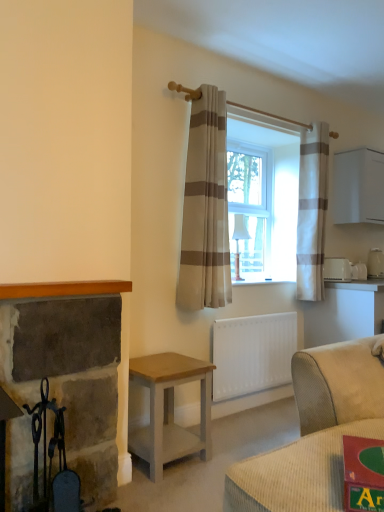
Locate an element on the screen. The height and width of the screenshot is (512, 384). black wrought iron fireplace tools at left is located at coordinates pos(52,458).

What do you see at coordinates (252, 354) in the screenshot? I see `white matte radiator at lower center` at bounding box center [252, 354].

How much space does white plastic toaster at right, positioned as the third appliance in left-to-right order, occupy vertically?

white plastic toaster at right, positioned as the third appliance in left-to-right order, is 11.09 inches in height.

What do you see at coordinates (375, 263) in the screenshot? I see `white plastic toaster at right, which ranks as the first appliance in right-to-left order` at bounding box center [375, 263].

Describe the element at coordinates (205, 207) in the screenshot. I see `beige striped curtain at center, the 1th curtain positioned from the front` at that location.

Where is `white plastic toaster at right, the third appliance positioned from the right`? The image size is (384, 512). white plastic toaster at right, the third appliance positioned from the right is located at coordinates (337, 269).

From a real-world perspective, which is physically below, white matte radiator at lower center or light brown wood table at lower center?

light brown wood table at lower center is physically lower.

Is white matte radiator at lower center to the right of light brown wood table at lower center from the viewer's perspective?

Indeed, white matte radiator at lower center is positioned on the right side of light brown wood table at lower center.

Where is `radiator located behind the light brown wood table at lower center`? Image resolution: width=384 pixels, height=512 pixels. radiator located behind the light brown wood table at lower center is located at coordinates (252, 354).

Is point (238, 383) positioned before point (151, 468)?

No, it is behind (151, 468).

Considering their positions, is white plastic toaster at right, which is counted as the first appliance, starting from the front, located in front of or behind black wrought iron fireplace tools at left?

In the image, white plastic toaster at right, which is counted as the first appliance, starting from the front, appears behind black wrought iron fireplace tools at left.

You are a GUI agent. You are given a task and a screenshot of the screen. Output one action in this format:
    pyautogui.click(x=<x>, y=<y>)
    Task: Click on the chair on the left side of white plastic toaster at right, the third appliance positioned from the right
    The height and width of the screenshot is (512, 384).
    Given the screenshot: What is the action you would take?
    pyautogui.click(x=52, y=458)

Is white plastic toaster at right, which is counted as the first appliance, starting from the front, wider or thinner than black wrought iron fireplace tools at left?

Clearly, white plastic toaster at right, which is counted as the first appliance, starting from the front, has more width compared to black wrought iron fireplace tools at left.

Between point (344, 263) and point (28, 409), which one is positioned behind?

The point (344, 263) is farther from the camera.

Is white plastic toaster at right, the third appliance positioned from the right, further to camera compared to rustic stone fireplace at left?

Yes, it is.

Is white plastic toaster at right, placed as the 1th appliance when sorted from left to right, taller than rustic stone fireplace at left?

No, white plastic toaster at right, placed as the 1th appliance when sorted from left to right, is not taller than rustic stone fireplace at left.

Does white plastic toaster at right, which ranks as the third appliance in back-to-front order, turn towards rustic stone fireplace at left?

No, white plastic toaster at right, which ranks as the third appliance in back-to-front order, is not facing towards rustic stone fireplace at left.

Is white plastic toaster at right, which is the 1th appliance in back-to-front order, wider or thinner than white glossy toaster at upper right, which is the second appliance from front to back?

Considering their sizes, white plastic toaster at right, which is the 1th appliance in back-to-front order, looks broader than white glossy toaster at upper right, which is the second appliance from front to back.

At what (x,y) coordinates should I click in order to perform the action: click on the 1st appliance to the left when counting from the white plastic toaster at right, positioned as the third appliance in left-to-right order. Please return your answer as a coordinate pair (x, y). Image resolution: width=384 pixels, height=512 pixels. Looking at the image, I should click on (358, 271).

Consider the image. Could you tell me if white plastic toaster at right, which ranks as the first appliance in right-to-left order, is facing white glossy toaster at upper right, which is the second appliance from front to back?

No, white plastic toaster at right, which ranks as the first appliance in right-to-left order, is not oriented towards white glossy toaster at upper right, which is the second appliance from front to back.

From a real-world perspective, relative to white glossy toaster at upper right, the second appliance viewed from the right, is white plastic toaster at right, which ranks as the first appliance in right-to-left order, vertically above or below?

Clearly, from a real-world perspective, white plastic toaster at right, which ranks as the first appliance in right-to-left order, is above white glossy toaster at upper right, the second appliance viewed from the right.

From a real-world perspective, who is located lower, white plastic toaster at right, placed as the 1th appliance when sorted from left to right, or light brown wood table at lower center?

In real-world perspective, light brown wood table at lower center is lower.

From the image's perspective, is white plastic toaster at right, the third appliance positioned from the right, beneath light brown wood table at lower center?

Actually, white plastic toaster at right, the third appliance positioned from the right, appears above light brown wood table at lower center in the image.

From their relative heights in the image, would you say white plastic toaster at right, which is counted as the first appliance, starting from the front, is taller or shorter than light brown wood table at lower center?

Considering their sizes, white plastic toaster at right, which is counted as the first appliance, starting from the front, has less height than light brown wood table at lower center.

Is white plastic toaster at right, the third appliance positioned from the right, closer to camera compared to light brown wood table at lower center?

No, white plastic toaster at right, the third appliance positioned from the right, is behind light brown wood table at lower center.

Which point is more forward, (254, 339) or (355, 271)?

Point (254, 339)

From a real-world perspective, which is physically below, white matte radiator at lower center or white glossy toaster at upper right, acting as the second appliance starting from the left?

In real-world perspective, white matte radiator at lower center is lower.

Which of these two, white matte radiator at lower center or white glossy toaster at upper right, marked as the second appliance in a back-to-front arrangement, stands shorter?

white glossy toaster at upper right, marked as the second appliance in a back-to-front arrangement, is shorter.

Is white matte radiator at lower center smaller than white glossy toaster at upper right, the second appliance viewed from the right?

No.

Find the location of a particular element. This screenshot has height=512, width=384. table in front of the white striped curtain at right, the second curtain positioned from the front is located at coordinates (169, 410).

From a real-world perspective, is white striped curtain at right, the second curtain positioned from the front, physically located above or below light brown wood table at lower center?

From a real-world perspective, white striped curtain at right, the second curtain positioned from the front, is physically above light brown wood table at lower center.

In the scene shown: Who is shorter, white striped curtain at right, marked as the second curtain in a left-to-right arrangement, or light brown wood table at lower center?

With less height is light brown wood table at lower center.

Is white striped curtain at right, the 1th curtain in the back-to-front sequence, not within light brown wood table at lower center?

white striped curtain at right, the 1th curtain in the back-to-front sequence, is positioned outside light brown wood table at lower center.

Locate an element on the screen. The height and width of the screenshot is (512, 384). table on the left of white matte radiator at lower center is located at coordinates (169, 410).

Locate an element on the screen. chair in front of the white plastic toaster at right, the third appliance positioned from the right is located at coordinates (52, 458).

Which object lies further to the anchor point light brown wood table at lower center, black wrought iron fireplace tools at left or rustic stone fireplace at left?

black wrought iron fireplace tools at left is positioned further to the anchor light brown wood table at lower center.

Which object lies further to the anchor point black wrought iron fireplace tools at left, white glossy toaster at upper right, marked as the second appliance in a back-to-front arrangement, or white plastic toaster at right, which is counted as the first appliance, starting from the front?

white glossy toaster at upper right, marked as the second appliance in a back-to-front arrangement, lies further to black wrought iron fireplace tools at left than the other object.

When comparing their distances from white glossy toaster at upper right, the second appliance viewed from the right, does black wrought iron fireplace tools at left or white striped curtain at right, the 1th curtain in the back-to-front sequence, seem further?

black wrought iron fireplace tools at left lies further to white glossy toaster at upper right, the second appliance viewed from the right, than the other object.

Looking at the image, which one is located closer to beige striped curtain at center, the second curtain in the back-to-front sequence, white glossy toaster at upper right, the second appliance viewed from the right, or white plastic toaster at right, which ranks as the first appliance in right-to-left order?

white glossy toaster at upper right, the second appliance viewed from the right, is positioned closer to the anchor beige striped curtain at center, the second curtain in the back-to-front sequence.

Considering their positions, is white glossy toaster at upper right, marked as the second appliance in a back-to-front arrangement, positioned further to rustic stone fireplace at left than light brown wood table at lower center?

Among the two, white glossy toaster at upper right, marked as the second appliance in a back-to-front arrangement, is located further to rustic stone fireplace at left.

Considering their positions, is white plastic toaster at right, which ranks as the first appliance in right-to-left order, positioned closer to rustic stone fireplace at left than white striped curtain at right, the second curtain positioned from the front?

Based on the image, white striped curtain at right, the second curtain positioned from the front, appears to be nearer to rustic stone fireplace at left.

Which object lies nearer to the anchor point white plastic toaster at right, placed as the 1th appliance when sorted from left to right, beige striped curtain at center, positioned as the second curtain in right-to-left order, or white glossy toaster at upper right, marked as the second appliance in a back-to-front arrangement?

white glossy toaster at upper right, marked as the second appliance in a back-to-front arrangement, is positioned closer to the anchor white plastic toaster at right, placed as the 1th appliance when sorted from left to right.

Looking at the image, which one is located further to white striped curtain at right, marked as the second curtain in a left-to-right arrangement, black wrought iron fireplace tools at left or beige striped curtain at center, the 1th curtain positioned from the left?

Among the two, black wrought iron fireplace tools at left is located further to white striped curtain at right, marked as the second curtain in a left-to-right arrangement.

Where is `appliance located between light brown wood table at lower center and white glossy toaster at upper right, the second appliance viewed from the right, in the left-right direction`? The height and width of the screenshot is (512, 384). appliance located between light brown wood table at lower center and white glossy toaster at upper right, the second appliance viewed from the right, in the left-right direction is located at coordinates (337, 269).

Identify the location of fireplace located between black wrought iron fireplace tools at left and white striped curtain at right, marked as the second curtain in a left-to-right arrangement, in the depth direction. The image size is (384, 512). (69, 366).

Find the location of a particular element. radiator between beige striped curtain at center, the second curtain in the back-to-front sequence, and white glossy toaster at upper right, acting as the second appliance starting from the left is located at coordinates (252, 354).

Where is `table positioned between black wrought iron fireplace tools at left and white striped curtain at right, the 1th curtain in the back-to-front sequence, from near to far`? This screenshot has width=384, height=512. table positioned between black wrought iron fireplace tools at left and white striped curtain at right, the 1th curtain in the back-to-front sequence, from near to far is located at coordinates (169, 410).